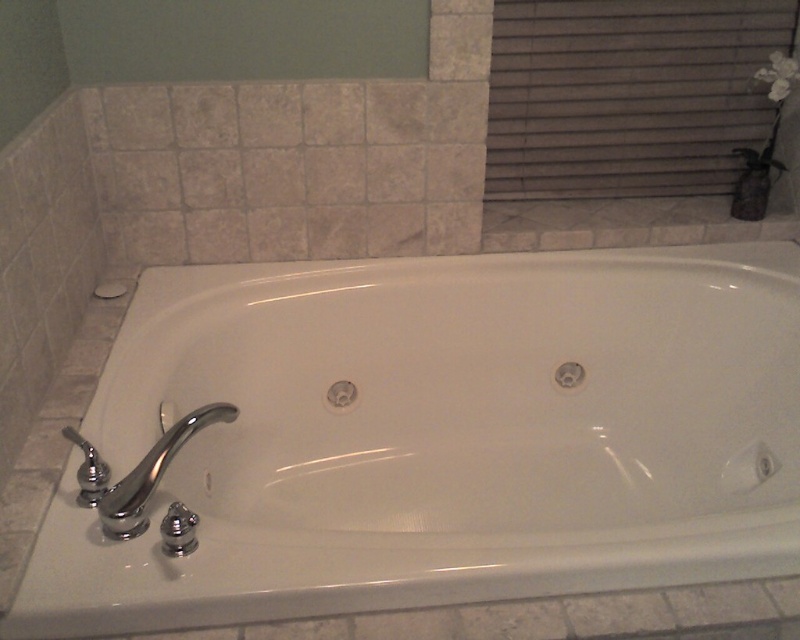
Question: Which point appears closest to the camera in this image?

Choices:
 (A) (672, 536)
 (B) (154, 445)

Answer: (A)

Question: Does white glossy bathtub at center have a lesser width compared to chrome/metallic faucet at lower left?

Choices:
 (A) no
 (B) yes

Answer: (A)

Question: Is white glossy bathtub at center to the left of chrome/metallic faucet at lower left from the viewer's perspective?

Choices:
 (A) yes
 (B) no

Answer: (B)

Question: Which point is farther to the camera?

Choices:
 (A) white glossy bathtub at center
 (B) chrome/metallic faucet at lower left

Answer: (B)

Question: Does white glossy bathtub at center have a lesser width compared to chrome/metallic faucet at lower left?

Choices:
 (A) no
 (B) yes

Answer: (A)